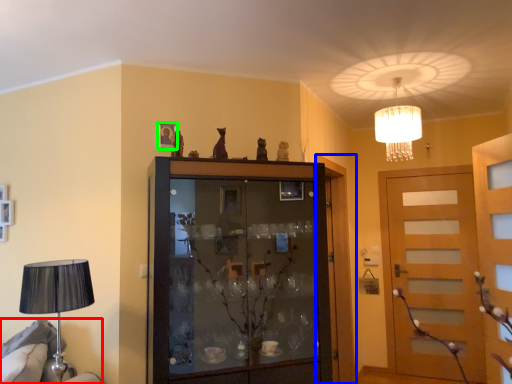
Question: Which is nearer to the furniture (highlighted by a red box)? door (highlighted by a blue box) or picture frame (highlighted by a green box).

Choices:
 (A) door
 (B) picture frame

Answer: (B)